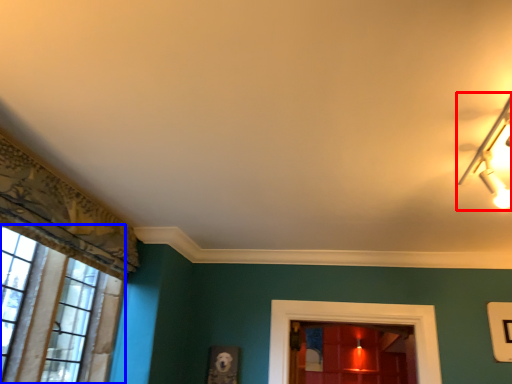
Question: Among these objects, which one is farthest to the camera, lamp (highlighted by a red box) or window (highlighted by a blue box)?

Choices:
 (A) lamp
 (B) window

Answer: (B)